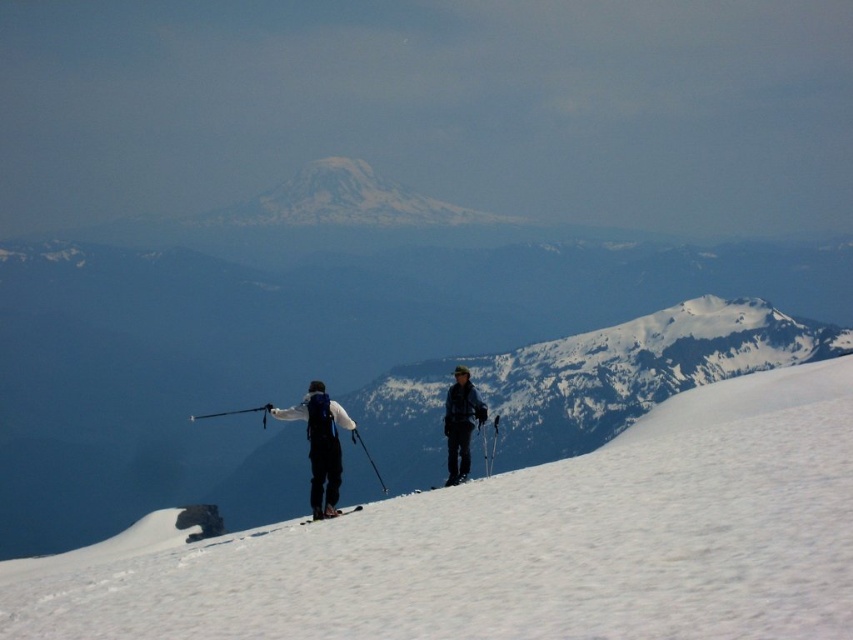
Does white snow at center come in front of dark blue ski suit at center?

Yes, white snow at center is closer to the viewer.

Can you confirm if white snow at center is wider than dark blue ski suit at center?

Yes.

Is point (751, 552) farther from camera compared to point (451, 467)?

That is False.

Image resolution: width=853 pixels, height=640 pixels. Find the location of `white snow at center`. white snow at center is located at coordinates (517, 544).

Does white snow at center have a greater width compared to black matte ski at lower center?

Yes, white snow at center is wider than black matte ski at lower center.

Does white snow at center have a larger size compared to black matte ski at lower center?

Yes.

This screenshot has height=640, width=853. What are the coordinates of `white snow at center` in the screenshot? It's located at (517, 544).

Can you confirm if white snow at center is wider than black matte ski pole at center?

Indeed, white snow at center has a greater width compared to black matte ski pole at center.

Find the location of a particular element. white snow at center is located at coordinates (517, 544).